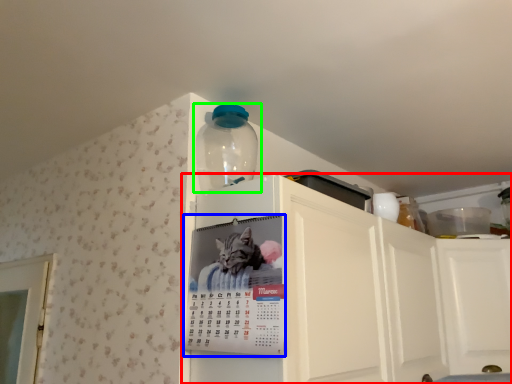
Question: Which object is positioned closest to cabinetry (highlighted by a red box)? Select from poster (highlighted by a blue box) and bottle (highlighted by a green box).

Choices:
 (A) poster
 (B) bottle

Answer: (A)